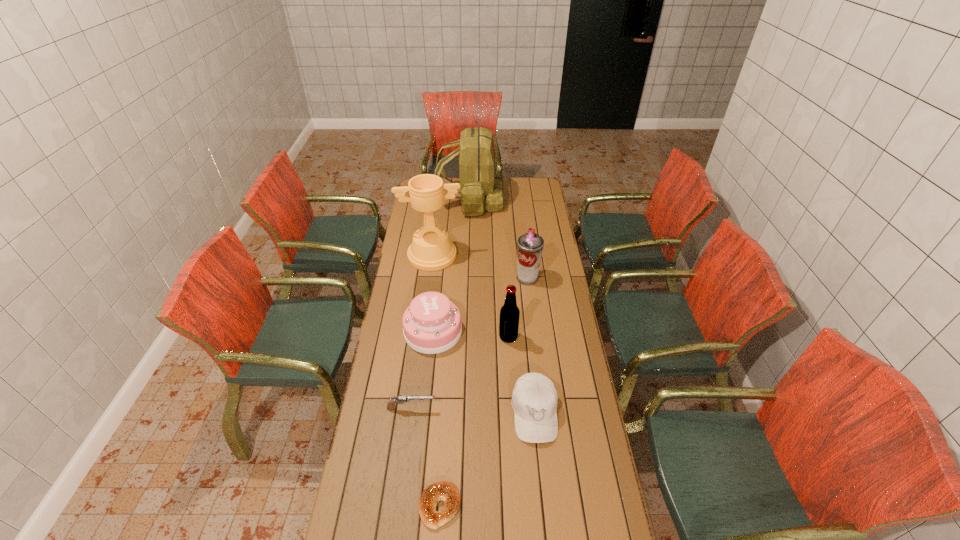
Identify the location of cake located at the left edge. Image resolution: width=960 pixels, height=540 pixels. (432, 324).

Find the location of a particular element. gun that is positioned at the left edge is located at coordinates (401, 399).

The width and height of the screenshot is (960, 540). I want to click on aerosol can located at the right edge, so click(x=530, y=245).

Image resolution: width=960 pixels, height=540 pixels. I want to click on baseball cap at the right edge, so click(534, 400).

At what (x,y) coordinates should I click in order to perform the action: click on object located at the far left corner. Please return your answer as a coordinate pair (x, y). Looking at the image, I should click on (480, 187).

This screenshot has width=960, height=540. Identify the location of vacant space at the left edge of the desktop. (410, 437).

Find the location of a particular element. vacant space at the right edge is located at coordinates (555, 233).

Where is `vacant space at the far right corner of the desktop`? This screenshot has height=540, width=960. vacant space at the far right corner of the desktop is located at coordinates (524, 182).

At what (x,y) coordinates should I click in order to perform the action: click on vacant space that is in between the gun and the nearest object. Please return your answer as a coordinate pair (x, y). The width and height of the screenshot is (960, 540). Looking at the image, I should click on (425, 457).

At what (x,y) coordinates should I click in order to perform the action: click on free spot between the award and the beer bottle. Please return your answer as a coordinate pair (x, y). Looking at the image, I should click on (470, 296).